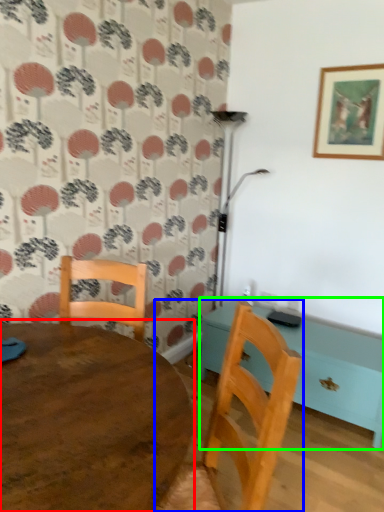
Question: Which is nearer to the table (highlighted by a red box)? chair (highlighted by a blue box) or table (highlighted by a green box).

Choices:
 (A) chair
 (B) table

Answer: (A)